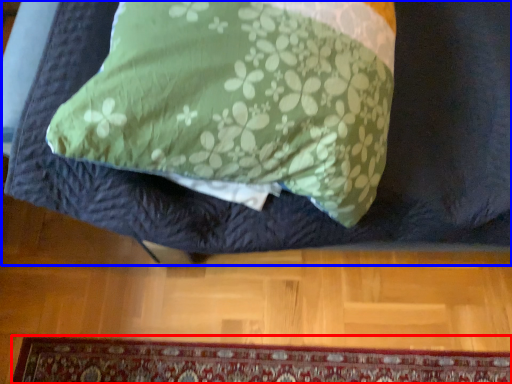
Question: Which of the following is the farthest to the observer, mat (highlighted by a red box) or furniture (highlighted by a blue box)?

Choices:
 (A) mat
 (B) furniture

Answer: (A)